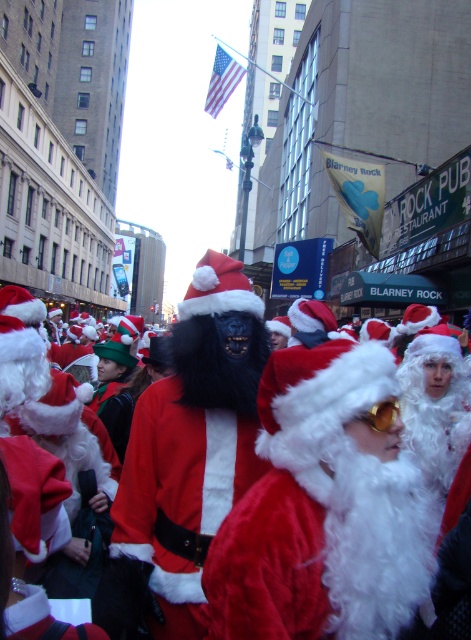
Is velvet santa costume at center to the left of fuzzy red santa at center from the viewer's perspective?

Incorrect, velvet santa costume at center is not on the left side of fuzzy red santa at center.

Where is `velvet santa costume at center`? velvet santa costume at center is located at coordinates (311, 483).

Which is in front, point (300, 364) or point (229, 442)?

Point (300, 364)

The height and width of the screenshot is (640, 471). I want to click on velvet santa costume at center, so click(311, 483).

Who is more distant from viewer, (416, 598) or (165, 499)?

Result: The point (165, 499) is behind.

In the scene shown: Does velvet red santa claus at center lie in front of fuzzy red santa at center?

Yes, it is.

Is point (425, 568) positioned after point (195, 380)?

No, (425, 568) is in front of (195, 380).

The image size is (471, 640). In order to click on velvet red santa claus at center in this screenshot , I will do `click(324, 508)`.

At what (x,y) coordinates should I click in order to perform the action: click on velvet santa costume at center. Please return your answer as a coordinate pair (x, y). This screenshot has height=640, width=471. Looking at the image, I should click on (311, 483).

Does velvet santa costume at center have a greater height compared to velvet red santa claus at center?

Correct, velvet santa costume at center is much taller as velvet red santa claus at center.

Does point (348, 340) come closer to viewer compared to point (292, 579)?

That is False.

Where is `velvet santa costume at center`? The width and height of the screenshot is (471, 640). velvet santa costume at center is located at coordinates (311, 483).